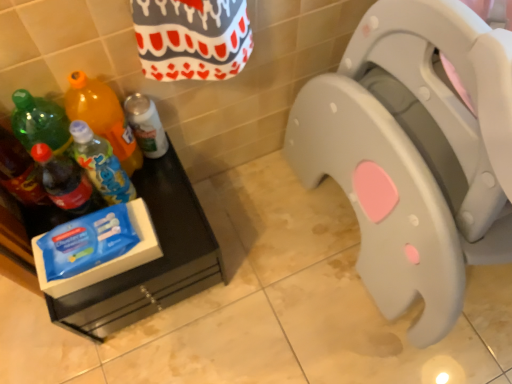
Find the location of `vacant area situated to the left side of gray plastic toilet seat at center`. vacant area situated to the left side of gray plastic toilet seat at center is located at coordinates (260, 264).